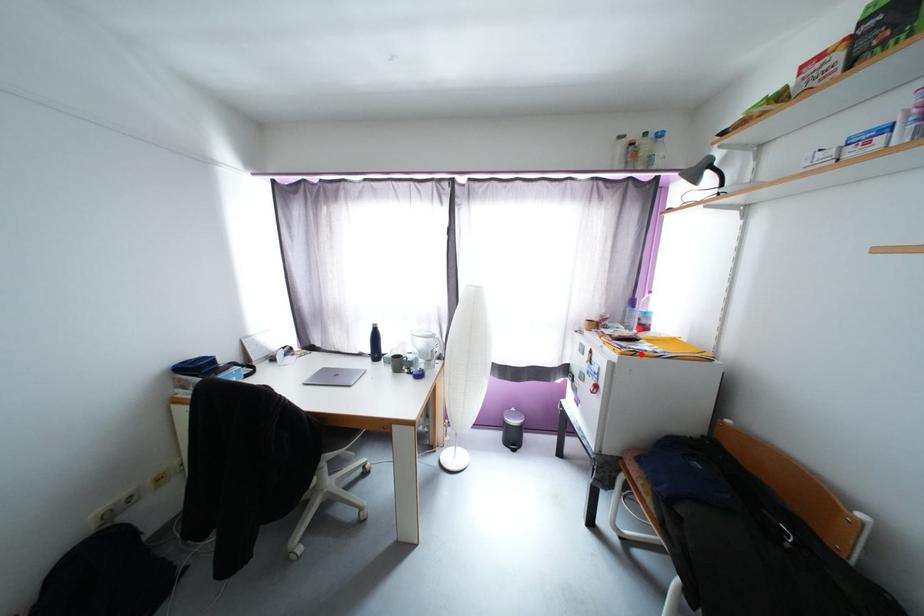
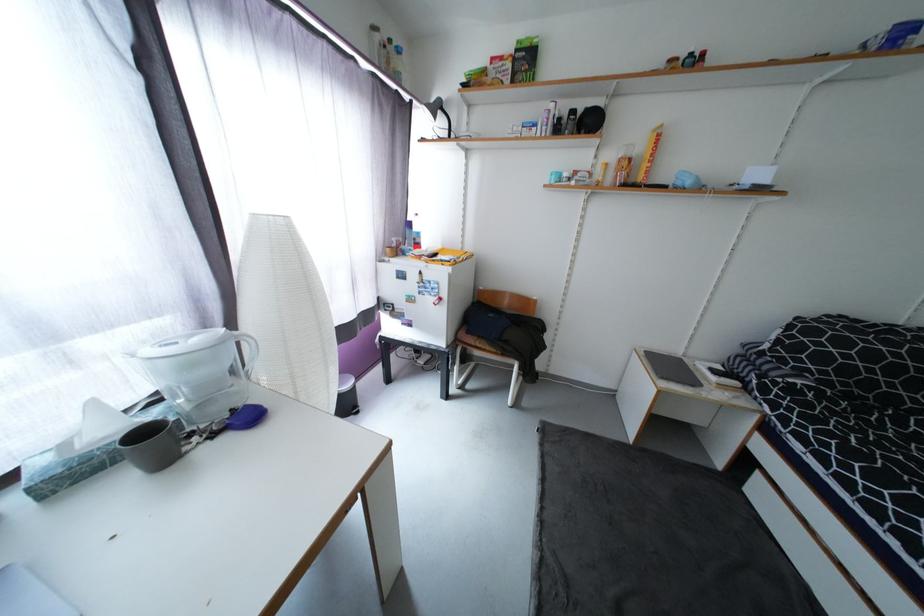
The point at the highlighted location is marked in the first image. Where is the corresponding point in the second image?

(460, 264)